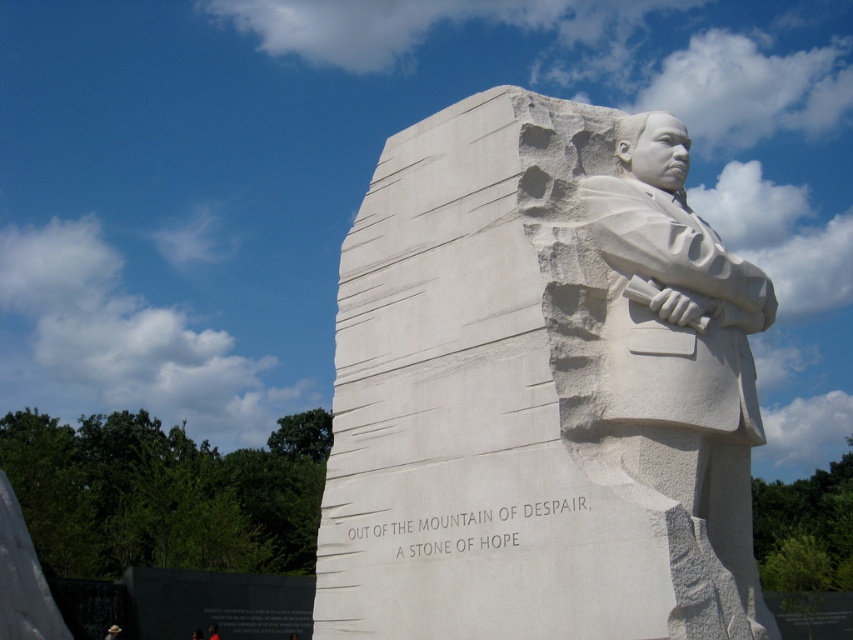
Question: In this image, where is white stone statue at center located relative to white stone statue at right?

Choices:
 (A) below
 (B) above

Answer: (A)

Question: Is white stone statue at center positioned in front of white stone statue at right?

Choices:
 (A) no
 (B) yes

Answer: (A)

Question: Which object is farther from the camera taking this photo?

Choices:
 (A) white stone statue at right
 (B) white stone statue at center

Answer: (B)

Question: Does white stone statue at center appear on the left side of white stone statue at right?

Choices:
 (A) yes
 (B) no

Answer: (A)